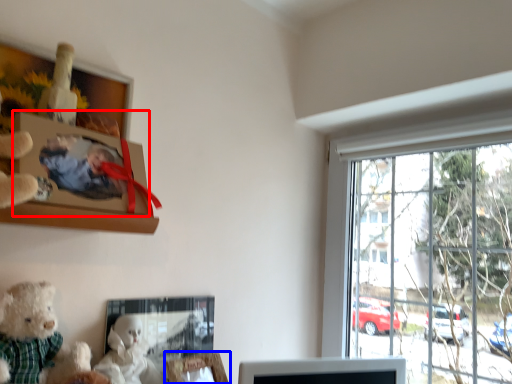
Question: Which object appears closest to the camera in this image, picture frame (highlighted by a red box) or picture frame (highlighted by a blue box)?

Choices:
 (A) picture frame
 (B) picture frame

Answer: (A)